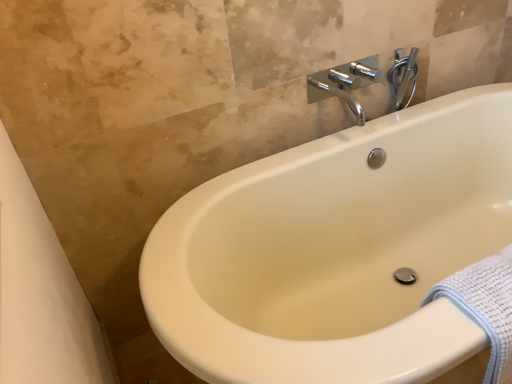
The width and height of the screenshot is (512, 384). What do you see at coordinates (402, 77) in the screenshot? I see `chrome metallic faucet at upper right` at bounding box center [402, 77].

What do you see at coordinates (485, 306) in the screenshot?
I see `white textured towel at lower right` at bounding box center [485, 306].

Where is `chrome metallic faucet at upper center`? This screenshot has width=512, height=384. chrome metallic faucet at upper center is located at coordinates (345, 83).

Is chrome metallic faucet at upper right at the right side of white textured towel at lower right?

No.

Which point is more distant from viewer, (396,51) or (495,283)?

Point (396,51)

Which object is closer to the camera, chrome metallic faucet at upper right or white textured towel at lower right?

white textured towel at lower right is closer to the camera.

Considering the sizes of objects chrome metallic faucet at upper right and white textured towel at lower right in the image provided, who is wider, chrome metallic faucet at upper right or white textured towel at lower right?

white textured towel at lower right is wider.

How much distance is there between chrome metallic faucet at upper center and white textured towel at lower right?

chrome metallic faucet at upper center and white textured towel at lower right are 33.76 inches apart from each other.

From the picture: Considering the relative positions of chrome metallic faucet at upper center and white textured towel at lower right in the image provided, is chrome metallic faucet at upper center in front of white textured towel at lower right?

No, the depth of chrome metallic faucet at upper center is greater than that of white textured towel at lower right.

Looking at their sizes, would you say chrome metallic faucet at upper center is wider or thinner than white textured towel at lower right?

Clearly, chrome metallic faucet at upper center has more width compared to white textured towel at lower right.

From a real-world perspective, between chrome metallic faucet at upper center and white textured towel at lower right, who is vertically higher?

In real-world perspective, chrome metallic faucet at upper center is above.

Is there a large distance between chrome metallic faucet at upper center and chrome metallic faucet at upper right?

No, chrome metallic faucet at upper center is not far away from chrome metallic faucet at upper right.

Considering the relative sizes of chrome metallic faucet at upper center and chrome metallic faucet at upper right in the image provided, is chrome metallic faucet at upper center shorter than chrome metallic faucet at upper right?

No, chrome metallic faucet at upper center is not shorter than chrome metallic faucet at upper right.

Do you think chrome metallic faucet at upper center is within chrome metallic faucet at upper right, or outside of it?

chrome metallic faucet at upper center cannot be found inside chrome metallic faucet at upper right.

From the image's perspective, which one is positioned higher, chrome metallic faucet at upper center or chrome metallic faucet at upper right?

chrome metallic faucet at upper right.

Is white textured towel at lower right taller or shorter than chrome metallic faucet at upper right?

Considering their sizes, white textured towel at lower right has more height than chrome metallic faucet at upper right.

From a real-world perspective, is white textured towel at lower right beneath chrome metallic faucet at upper right?

Correct, in the physical world, white textured towel at lower right is lower than chrome metallic faucet at upper right.

Which is more to the left, white textured towel at lower right or chrome metallic faucet at upper right?

From the viewer's perspective, chrome metallic faucet at upper right appears more on the left side.

Can you confirm if chrome metallic faucet at upper right is taller than chrome metallic faucet at upper center?

In fact, chrome metallic faucet at upper right may be shorter than chrome metallic faucet at upper center.

Is chrome metallic faucet at upper right placed right next to chrome metallic faucet at upper center?

Yes, chrome metallic faucet at upper right is with chrome metallic faucet at upper center.

Considering the relative positions of white textured towel at lower right and chrome metallic faucet at upper center in the image provided, is white textured towel at lower right to the right of chrome metallic faucet at upper center from the viewer's perspective?

Indeed, white textured towel at lower right is positioned on the right side of chrome metallic faucet at upper center.

Is white textured towel at lower right closer to the viewer compared to chrome metallic faucet at upper center?

Yes, it is.

Would you say chrome metallic faucet at upper center is part of white textured towel at lower right's contents?

No, chrome metallic faucet at upper center is not surrounded by white textured towel at lower right.

The width and height of the screenshot is (512, 384). I want to click on bath towel below the chrome metallic faucet at upper right (from a real-world perspective), so click(485, 306).

You are a GUI agent. You are given a task and a screenshot of the screen. Output one action in this format:
    pyautogui.click(x=<x>, y=<y>)
    Task: Click on the bath towel that is on the right side of chrome metallic faucet at upper center
    Image resolution: width=512 pixels, height=384 pixels.
    Given the screenshot: What is the action you would take?
    pyautogui.click(x=485, y=306)

Considering their positions, is chrome metallic faucet at upper right positioned closer to chrome metallic faucet at upper center than white textured towel at lower right?

Based on the image, chrome metallic faucet at upper right appears to be nearer to chrome metallic faucet at upper center.

Which object lies further to the anchor point white textured towel at lower right, chrome metallic faucet at upper right or chrome metallic faucet at upper center?

Among the two, chrome metallic faucet at upper right is located further to white textured towel at lower right.

Estimate the real-world distances between objects in this image. Which object is further from chrome metallic faucet at upper right, chrome metallic faucet at upper center or white textured towel at lower right?

white textured towel at lower right is further to chrome metallic faucet at upper right.

Estimate the real-world distances between objects in this image. Which object is closer to white textured towel at lower right, chrome metallic faucet at upper center or chrome metallic faucet at upper right?

Among the two, chrome metallic faucet at upper center is located nearer to white textured towel at lower right.

Estimate the real-world distances between objects in this image. Which object is closer to chrome metallic faucet at upper right, white textured towel at lower right or chrome metallic faucet at upper center?

chrome metallic faucet at upper center lies closer to chrome metallic faucet at upper right than the other object.

Considering their positions, is white textured towel at lower right positioned closer to chrome metallic faucet at upper center than chrome metallic faucet at upper right?

chrome metallic faucet at upper right lies closer to chrome metallic faucet at upper center than the other object.

The width and height of the screenshot is (512, 384). In order to click on tap positioned between white textured towel at lower right and chrome metallic faucet at upper right from near to far in this screenshot , I will do `click(345, 83)`.